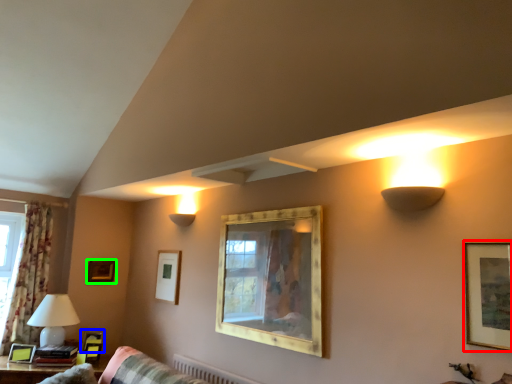
Question: Which object is the farthest from picture frame (highlighted by a red box)? Choose among these: picture frame (highlighted by a blue box) or picture frame (highlighted by a green box).

Choices:
 (A) picture frame
 (B) picture frame

Answer: (B)